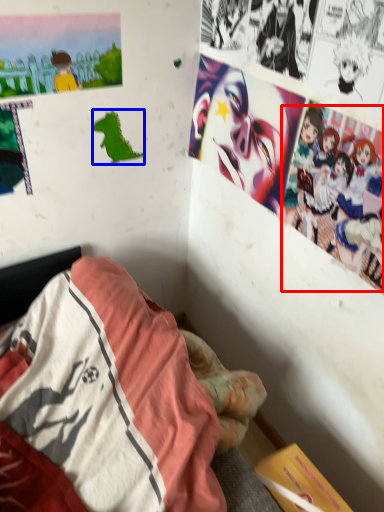
Question: Which point is closer to the camera, person (highlighted by a red box) or art (highlighted by a blue box)?

Choices:
 (A) person
 (B) art

Answer: (A)